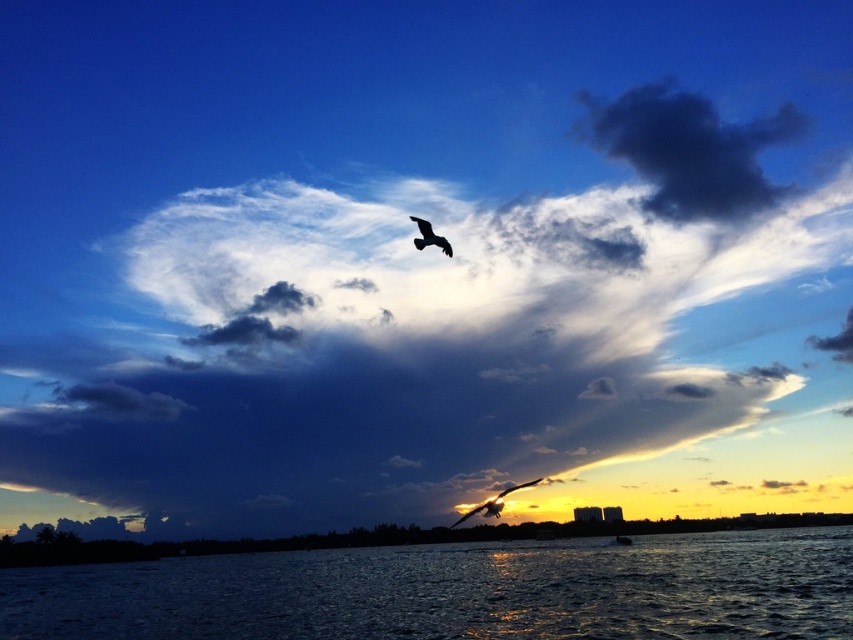
Question: Can you confirm if glistening dark water at lower center is positioned to the right of black matte bird at upper center?

Choices:
 (A) yes
 (B) no

Answer: (A)

Question: Is dark blue cloud at upper center closer to the viewer compared to black matte bird at upper center?

Choices:
 (A) yes
 (B) no

Answer: (B)

Question: Which point is closer to the camera?

Choices:
 (A) dark blue cloud at upper center
 (B) silhouette feathered bird at center

Answer: (B)

Question: Can you confirm if glistening dark water at lower center is positioned above black matte bird at upper center?

Choices:
 (A) no
 (B) yes

Answer: (A)

Question: Which of the following is the farthest from the observer?

Choices:
 (A) black matte bird at upper center
 (B) glistening dark water at lower center
 (C) dark blue cloud at upper center
 (D) silhouette feathered bird at center

Answer: (C)

Question: Which object is positioned closest to the dark blue cloud at upper center?

Choices:
 (A) glistening dark water at lower center
 (B) silhouette feathered bird at center

Answer: (A)